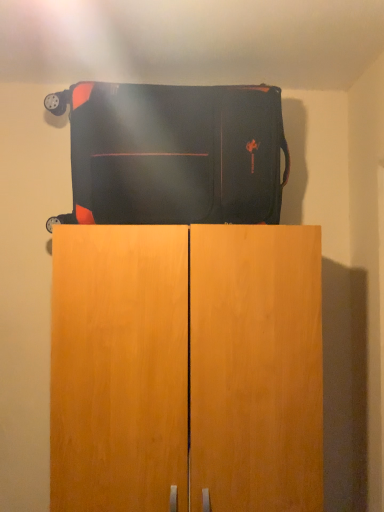
Question: Should I look upward or downward to see matte black suitcase at center?

Choices:
 (A) up
 (B) down

Answer: (A)